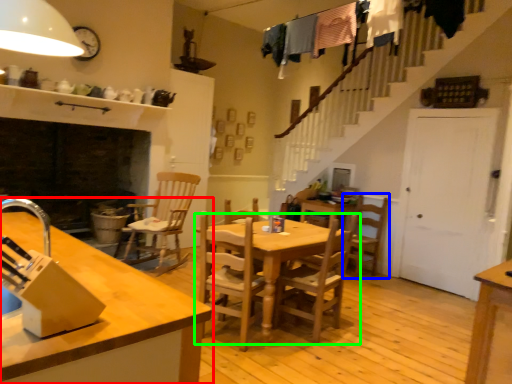
Question: Which is nearer to the countertop (highlighted by a red box)? chair (highlighted by a blue box) or kitchen & dining room table (highlighted by a green box).

Choices:
 (A) chair
 (B) kitchen & dining room table

Answer: (B)